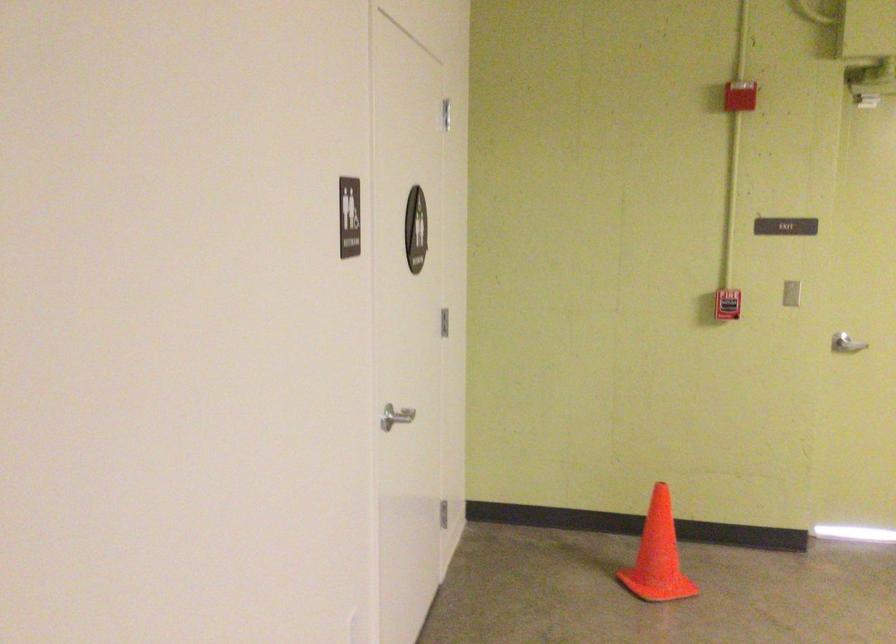
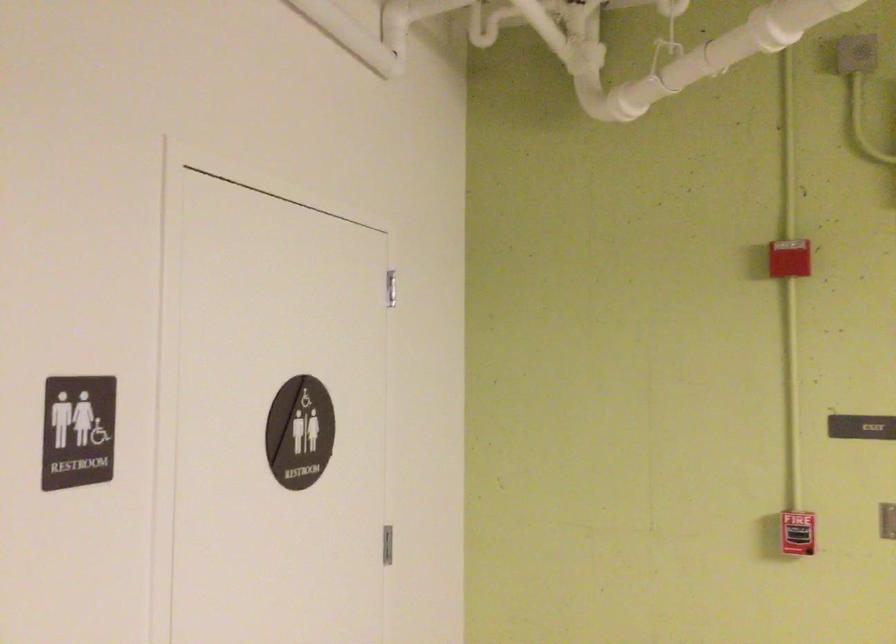
Question: The images are taken continuously from a first-person perspective. In which direction is your viewpoint rotating?

Choices:
 (A) Left
 (B) Right
 (C) Up
 (D) Down

Answer: (C)